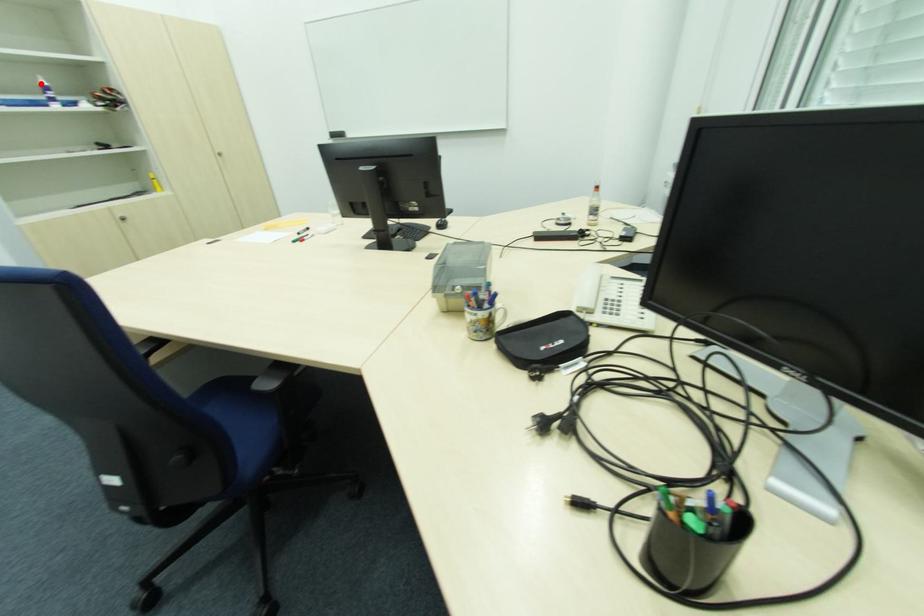
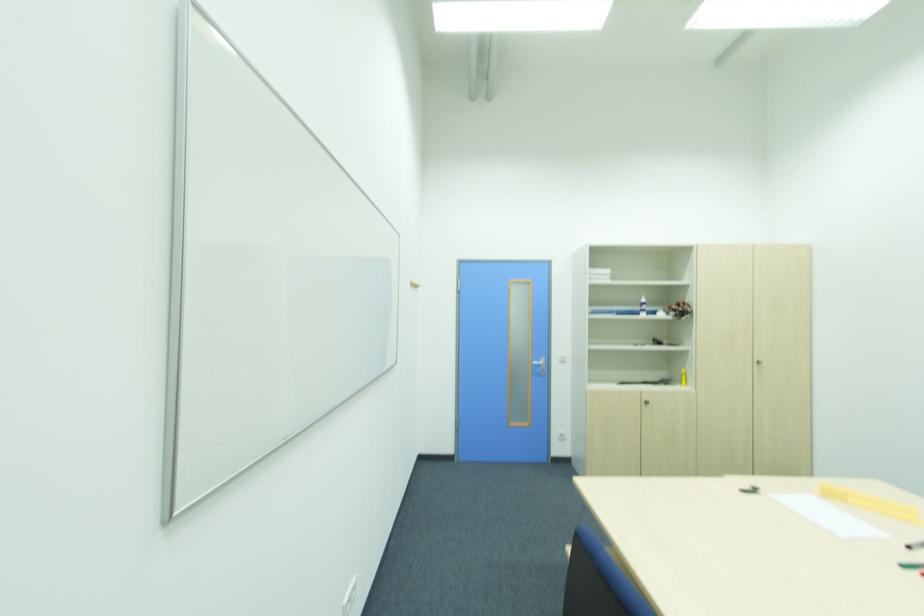
Find the pixel in the second image that matches the highlighted location in the first image.

(643, 301)